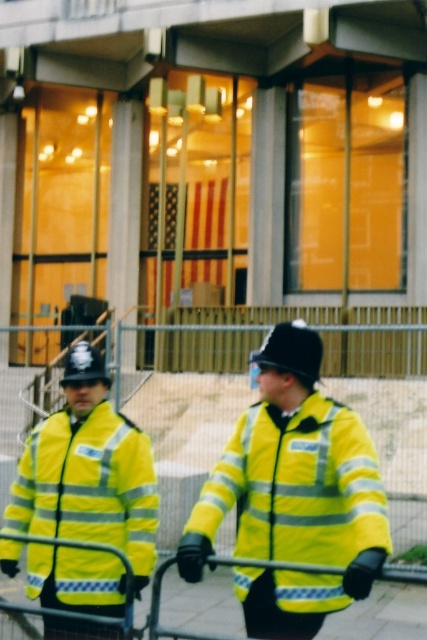
Question: Can you confirm if yellow reflective jacket at center is wider than yellow reflective jacket at left?

Choices:
 (A) no
 (B) yes

Answer: (B)

Question: Which object appears closest to the camera in this image?

Choices:
 (A) yellow reflective jacket at left
 (B) yellow reflective jacket at center

Answer: (B)

Question: Which point is closer to the camera?

Choices:
 (A) (303, 500)
 (B) (132, 490)

Answer: (A)

Question: Can you confirm if yellow reflective jacket at center is thinner than yellow reflective jacket at left?

Choices:
 (A) no
 (B) yes

Answer: (A)

Question: Considering the relative positions of yellow reflective jacket at center and yellow reflective jacket at left in the image provided, where is yellow reflective jacket at center located with respect to yellow reflective jacket at left?

Choices:
 (A) left
 (B) right

Answer: (B)